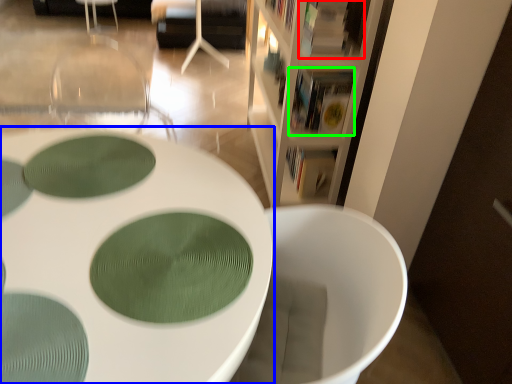
Question: Estimate the real-world distances between objects in this image. Which object is farther from book (highlighted by a red box), table (highlighted by a blue box) or book (highlighted by a green box)?

Choices:
 (A) table
 (B) book

Answer: (A)